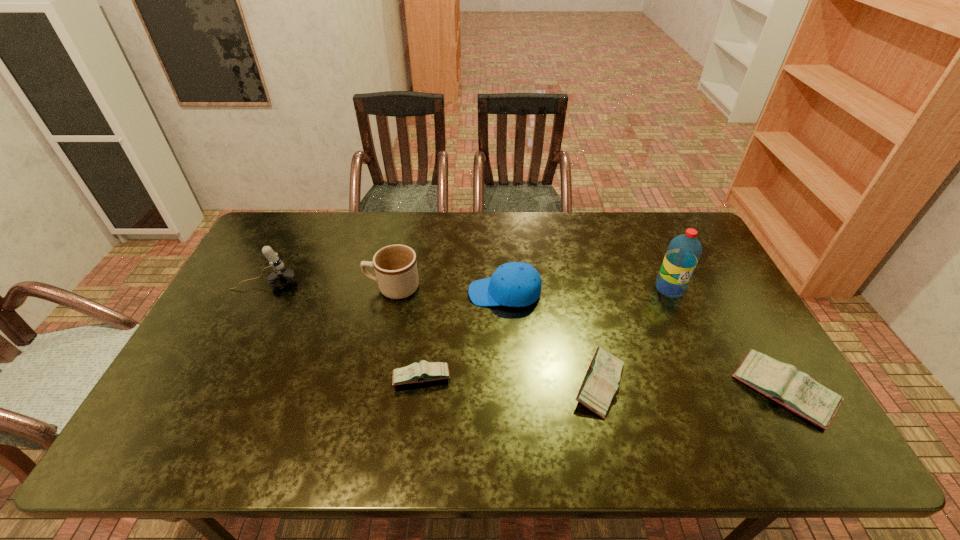
Find the location of a particular element. The image size is (960, 540). mug is located at coordinates (395, 266).

At what (x,y) coordinates should I click in order to perform the action: click on microphone. Please return your answer as a coordinate pair (x, y). Looking at the image, I should click on (281, 277).

Locate an element on the screen. The image size is (960, 540). the leftmost object is located at coordinates (281, 277).

The image size is (960, 540). Identify the location of vacant space situated 0.160m on the left of the leftmost diary. (330, 377).

Find the location of a particular element. The height and width of the screenshot is (540, 960). free space located on the right of the fifth object from left to right is located at coordinates (677, 384).

Identify the location of free space located 0.380m on the left of the third shortest object. (588, 391).

Find the location of a particular element. The image size is (960, 540). vacant area located on the front-facing side of the fourth shortest object is located at coordinates (410, 293).

I want to click on vacant area situated on the front-facing side of the fourth shortest object, so click(385, 293).

This screenshot has height=540, width=960. What are the coordinates of `vacant space located 0.200m on the front-facing side of the fourth shortest object` in the screenshot? It's located at (404, 293).

This screenshot has height=540, width=960. Identify the location of vacant space situated 0.140m on the front label of the tallest object. (690, 334).